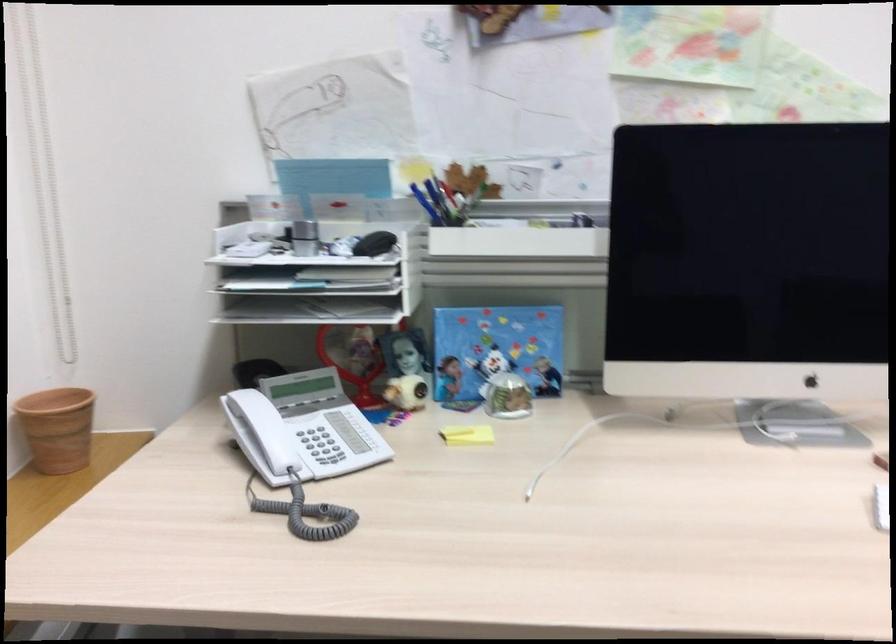
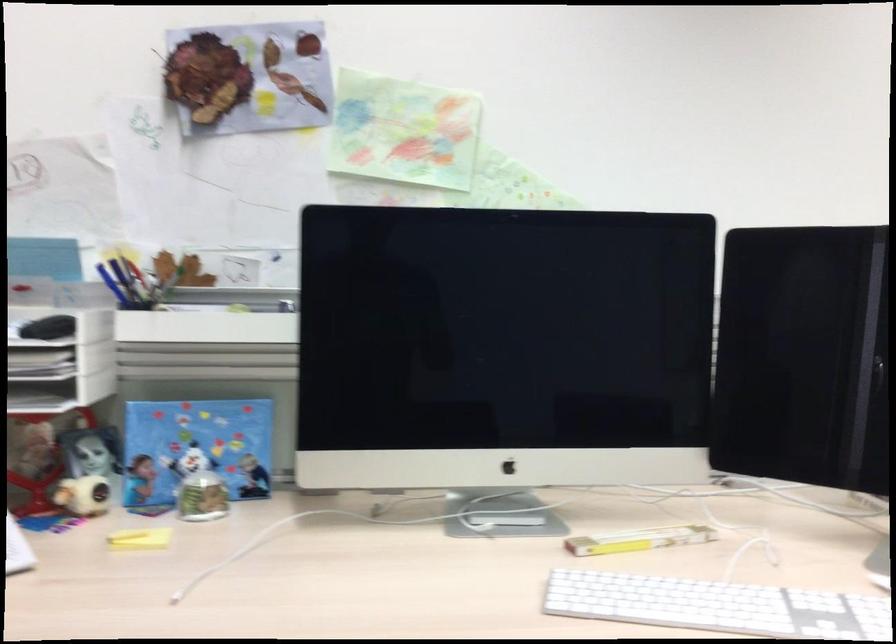
The point at (424, 200) is marked in the first image. Where is the corresponding point in the second image?

(113, 285)